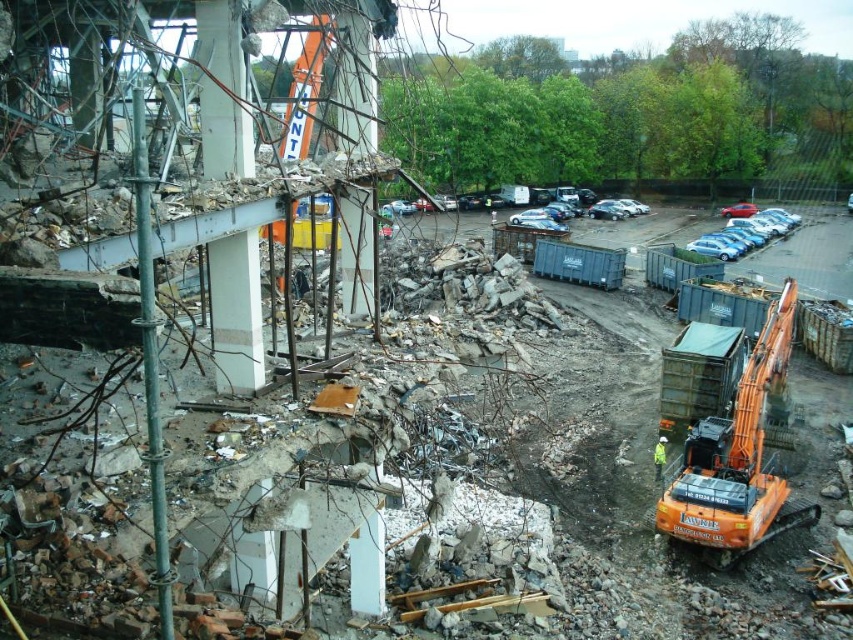
Image resolution: width=853 pixels, height=640 pixels. Describe the element at coordinates (223, 92) in the screenshot. I see `concrete at center` at that location.

Is concrete at center smaller than green reflective safety vest at lower right?

Incorrect, concrete at center is not smaller in size than green reflective safety vest at lower right.

Does point (241, 141) lie in front of point (660, 458)?

Yes, it is.

At what (x,y) coordinates should I click in order to perform the action: click on concrete at center. Please return your answer as a coordinate pair (x, y). Looking at the image, I should click on (223, 92).

Who is positioned more to the right, concrete pillar at center or green reflective safety vest at lower right?

From the viewer's perspective, green reflective safety vest at lower right appears more on the right side.

Which is above, concrete pillar at center or green reflective safety vest at lower right?

concrete pillar at center is higher up.

Locate an element on the screen. This screenshot has height=640, width=853. concrete pillar at center is located at coordinates (355, 86).

Which of these two, orange metallic excavator at lower right or blue metallic car at right, stands taller?

With more height is orange metallic excavator at lower right.

Does orange metallic excavator at lower right have a lesser height compared to blue metallic car at right?

No, orange metallic excavator at lower right is not shorter than blue metallic car at right.

Image resolution: width=853 pixels, height=640 pixels. I want to click on orange metallic excavator at lower right, so click(x=740, y=458).

Identify the location of orange metallic excavator at lower right. The height and width of the screenshot is (640, 853). (740, 458).